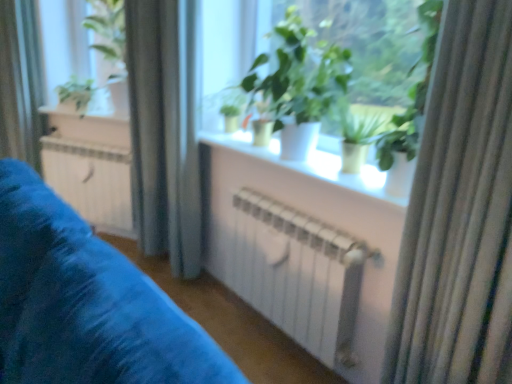
Question: Is the depth of white metallic radiator at center greater than that of green matte plant at center, which is the 1th houseplant in right-to-left order?

Choices:
 (A) yes
 (B) no

Answer: (A)

Question: Is white metallic radiator at center directly adjacent to green matte plant at center, which is the 2th houseplant from front to back?

Choices:
 (A) yes
 (B) no

Answer: (B)

Question: Is white metallic radiator at center positioned in front of green matte plant at center, marked as the 2th houseplant in a back-to-front arrangement?

Choices:
 (A) yes
 (B) no

Answer: (B)

Question: Is white metallic radiator at center outside green matte plant at center, which is the 1th houseplant in right-to-left order?

Choices:
 (A) yes
 (B) no

Answer: (A)

Question: Is white metallic radiator at center facing away from green matte plant at center, which is the 1th houseplant in right-to-left order?

Choices:
 (A) no
 (B) yes

Answer: (A)

Question: Is white metallic radiator at center taller or shorter than white matte window sill at center, arranged as the first window sill when viewed from the right?

Choices:
 (A) tall
 (B) short

Answer: (A)

Question: Considering the positions of white metallic radiator at center and white matte window sill at center, arranged as the first window sill when viewed from the right, in the image, is white metallic radiator at center bigger or smaller than white matte window sill at center, arranged as the first window sill when viewed from the right,?

Choices:
 (A) big
 (B) small

Answer: (A)

Question: Is white metallic radiator at center to the left or to the right of white matte window sill at center, marked as the second window sill in a back-to-front arrangement, in the image?

Choices:
 (A) left
 (B) right

Answer: (A)

Question: From the image's perspective, relative to white matte window sill at center, marked as the second window sill in a back-to-front arrangement, is white metallic radiator at center above or below?

Choices:
 (A) below
 (B) above

Answer: (A)

Question: Considering their positions, is silky beige curtain at right, placed as the third curtain when sorted from back to front, located in front of or behind satin fabric curtain at left, arranged as the second curtain when viewed from the left?

Choices:
 (A) front
 (B) behind

Answer: (A)

Question: From a real-world perspective, is silky beige curtain at right, placed as the third curtain when sorted from back to front, positioned above or below satin fabric curtain at left, arranged as the second curtain when viewed from the left?

Choices:
 (A) above
 (B) below

Answer: (A)

Question: Which is correct: silky beige curtain at right, the 1th curtain from the front, is inside satin fabric curtain at left, marked as the second curtain in a back-to-front arrangement, or outside of it?

Choices:
 (A) inside
 (B) outside

Answer: (B)

Question: Is silky beige curtain at right, arranged as the 3th curtain when viewed from the left, to the left or to the right of satin fabric curtain at left, arranged as the second curtain when viewed from the left, in the image?

Choices:
 (A) left
 (B) right

Answer: (B)

Question: Do you think white matte radiator at center is within silky beige curtain at right, arranged as the 3th curtain when viewed from the left, or outside of it?

Choices:
 (A) outside
 (B) inside

Answer: (A)

Question: Relative to silky beige curtain at right, arranged as the 3th curtain when viewed from the left, is white matte radiator at center in front or behind?

Choices:
 (A) behind
 (B) front

Answer: (B)